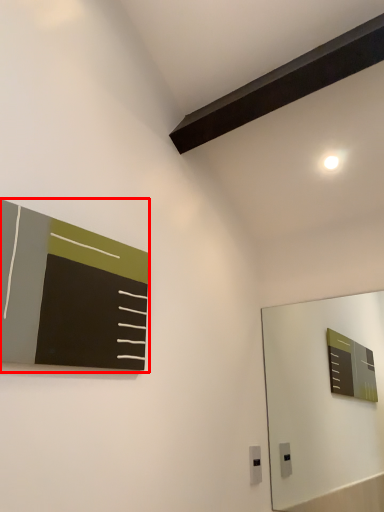
Question: In this image, where is bulletin board (annotated by the red box) located relative to electric outlet?

Choices:
 (A) right
 (B) left

Answer: (B)